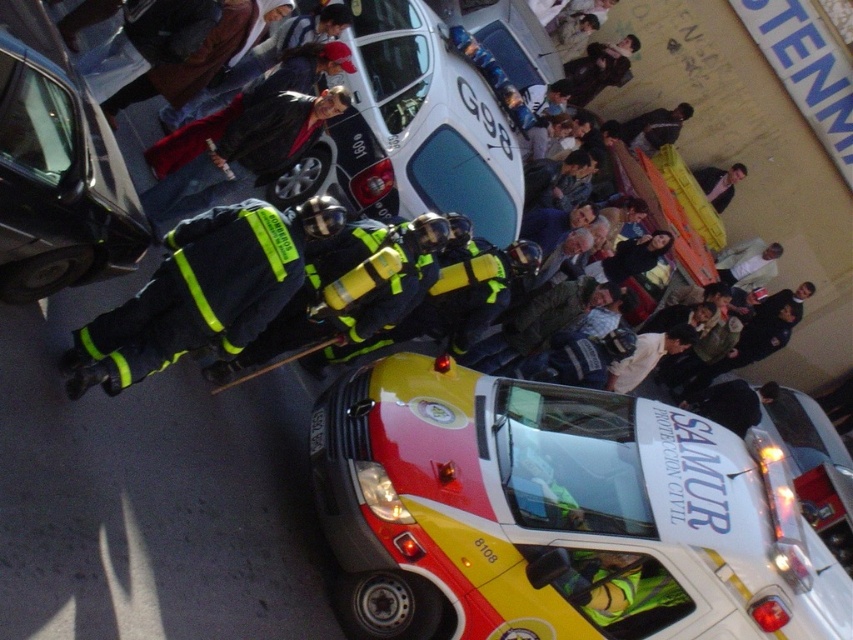
You are a pedestrian standing on the sidewalk and see the shiny black car at center and the dark blue uniform at center. Which object is closer to you?

The shiny black car at center is closer to you because it is in front of the dark blue uniform at center.

You are a pedestrian standing at the point marked by the coordinates point (56,170). What object is directly in front of you?

The shiny black car at center is directly in front of you at point (56,170).

You are a drone operator tasked with delivering a package to the yellow and red plastic car at center. According to the coordinates provided, where should you direct the drone to drop the package?

The yellow and red plastic car at center is located at point (556,515), so you should direct the drone to drop the package at those coordinates.